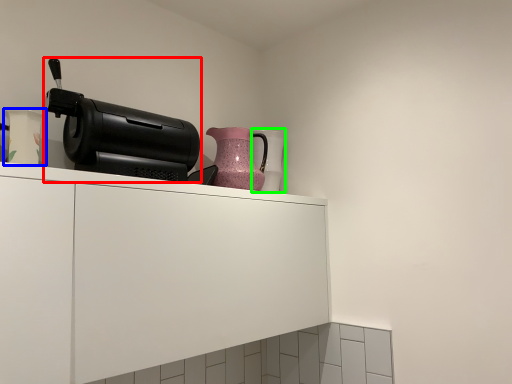
Question: Which object is the farthest from home appliance (highlighted by a red box)? Choose among these: vase (highlighted by a blue box) or vase (highlighted by a green box).

Choices:
 (A) vase
 (B) vase

Answer: (B)